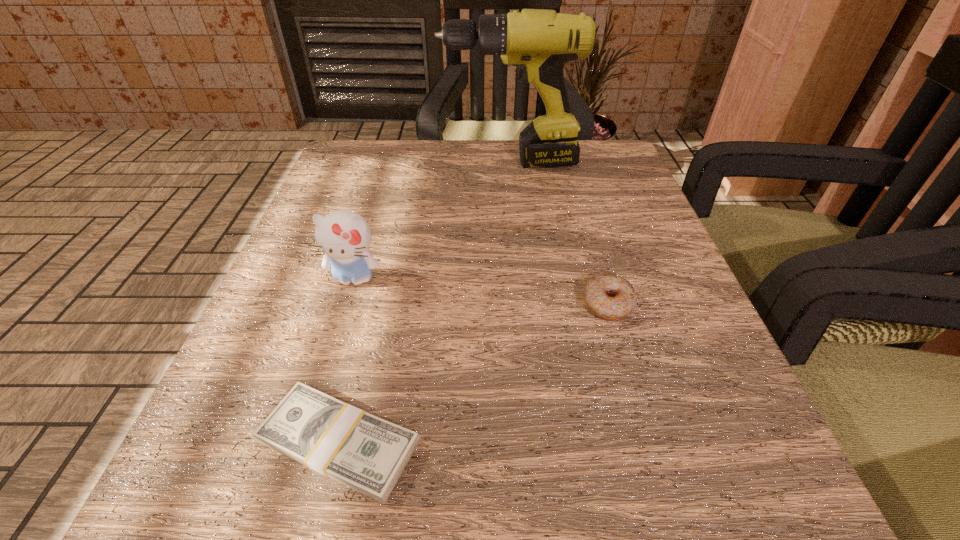
Where is `free space that satisfies the following two spatial constraints: 1. on the front-facing side of the shortest object; 2. on the right side of the second tallest object`? free space that satisfies the following two spatial constraints: 1. on the front-facing side of the shortest object; 2. on the right side of the second tallest object is located at coordinates (303, 442).

Image resolution: width=960 pixels, height=540 pixels. What are the coordinates of `vacant region that satisfies the following two spatial constraints: 1. on the back side of the third tallest object; 2. on the right side of the shortest object` in the screenshot? It's located at (372, 303).

Where is `vacant region that satisfies the following two spatial constraints: 1. on the front-facing side of the dollar; 2. on the right side of the second tallest object`? vacant region that satisfies the following two spatial constraints: 1. on the front-facing side of the dollar; 2. on the right side of the second tallest object is located at coordinates (303, 442).

Locate an element on the screen. vacant region that satisfies the following two spatial constraints: 1. on the handle side of the tallest object; 2. on the back side of the doughnut is located at coordinates (523, 303).

Find the location of a particular element. free location that satisfies the following two spatial constraints: 1. on the handle side of the second shortest object; 2. on the left side of the tallest object is located at coordinates (523, 303).

You are a GUI agent. You are given a task and a screenshot of the screen. Output one action in this format:
    pyautogui.click(x=<x>, y=<y>)
    Task: Click on the free space that satisfies the following two spatial constraints: 1. on the back side of the second shortest object; 2. on the handle side of the tallest object
    The image size is (960, 540).
    Given the screenshot: What is the action you would take?
    pyautogui.click(x=566, y=162)